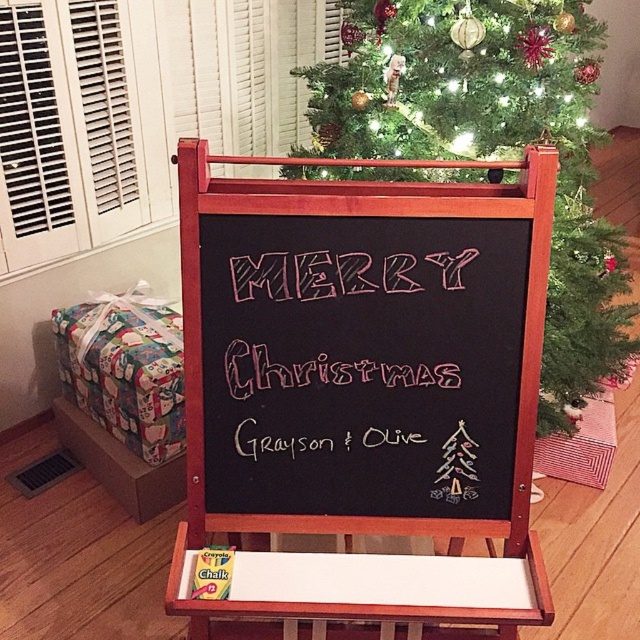
You are standing in front of the chalkboard easel at the center of the scene. To your left, there is a wrapped gift on a wooden bench. Where is the green textured christmas tree at upper center relative to your position?

The green textured christmas tree at upper center is located at point 0.230 on the x axis and 0.773 on the y axis relative to your position.

You are a guest at a Christmas party and see the black chalkboard at center and the pink chalk merry christmas at center. Which object is closer to you?

The black chalkboard at center is closer to you because it is in front of the pink chalk merry christmas at center.